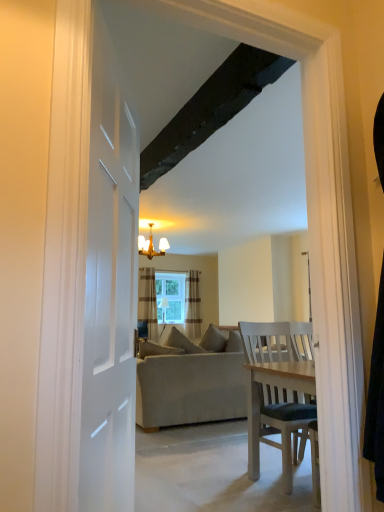
Question: From the image's perspective, is gold metallic chandelier at upper center located above or below striped fabric curtain at center, positioned as the 1th curtain in right-to-left order?

Choices:
 (A) below
 (B) above

Answer: (B)

Question: Choose the correct answer: Is gold metallic chandelier at upper center inside striped fabric curtain at center, the 2th curtain in the left-to-right sequence, or outside it?

Choices:
 (A) outside
 (B) inside

Answer: (A)

Question: Estimate the real-world distances between objects in this image. Which object is farther from the gold metallic chandelier at upper center?

Choices:
 (A) striped fabric curtain at center, the 2th curtain in the left-to-right sequence
 (B) clear glass window at center
 (C) brown striped curtain at center, the 2th curtain viewed from the right
 (D) beige fabric couch at center

Answer: (D)

Question: Which is nearer to the beige fabric couch at center?

Choices:
 (A) clear glass window at center
 (B) brown striped curtain at center, the 1th curtain in the left-to-right sequence
 (C) striped fabric curtain at center, positioned as the 1th curtain in right-to-left order
 (D) gold metallic chandelier at upper center

Answer: (D)